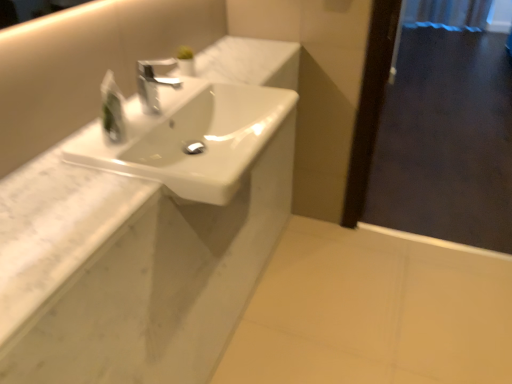
Image resolution: width=512 pixels, height=384 pixels. Find the location of `free point above white marble counter at upper left (from a real-world perspective)`. free point above white marble counter at upper left (from a real-world perspective) is located at coordinates (123, 157).